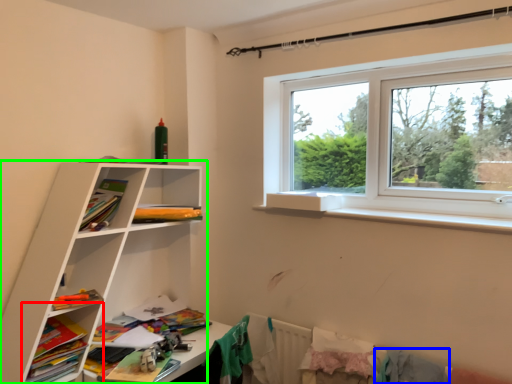
Question: Which object is positioned farthest from shelf (highlighted by a red box)? Select from clothing (highlighted by a blue box) and shelf (highlighted by a green box).

Choices:
 (A) clothing
 (B) shelf

Answer: (A)